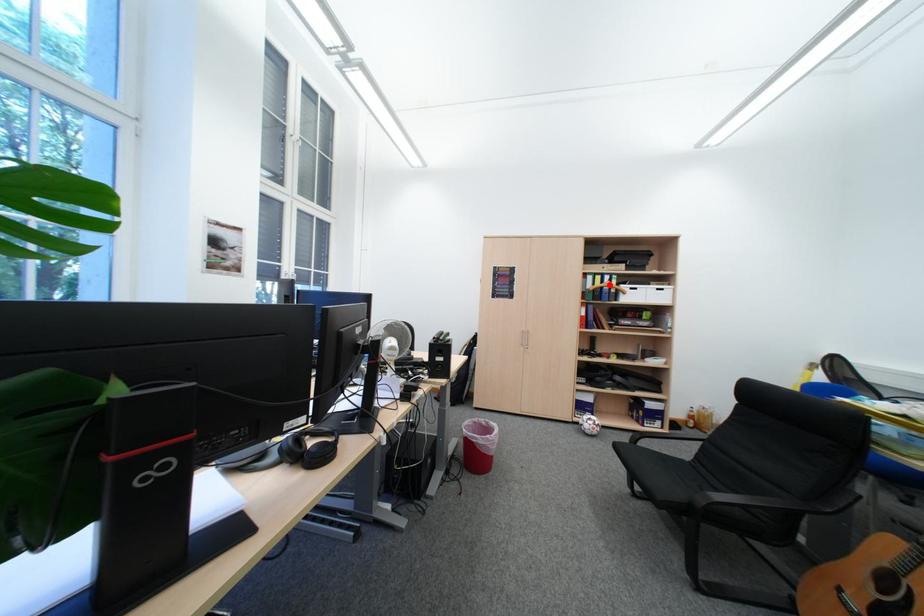
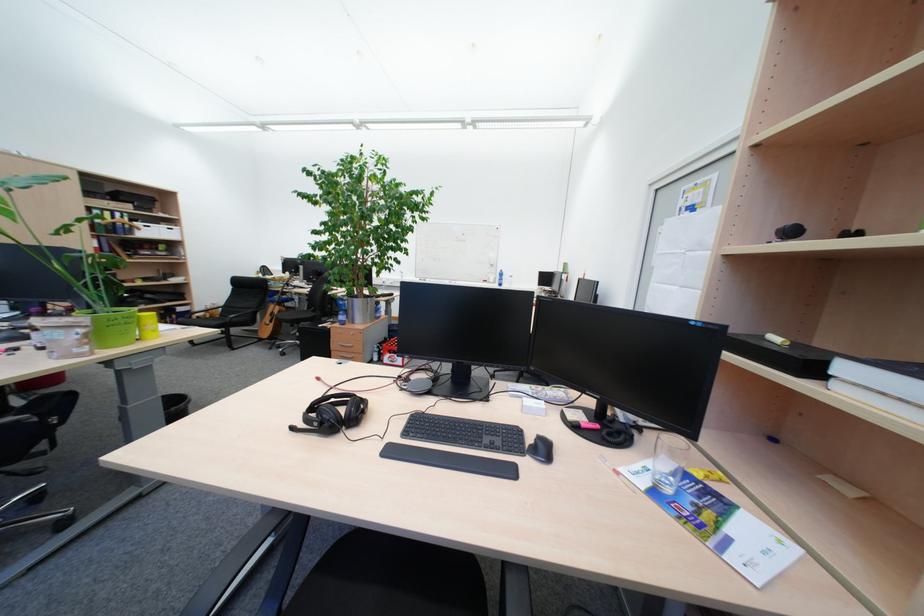
Locate, in the second image, the point that corresponds to the highlighted location in the first image.

(120, 220)